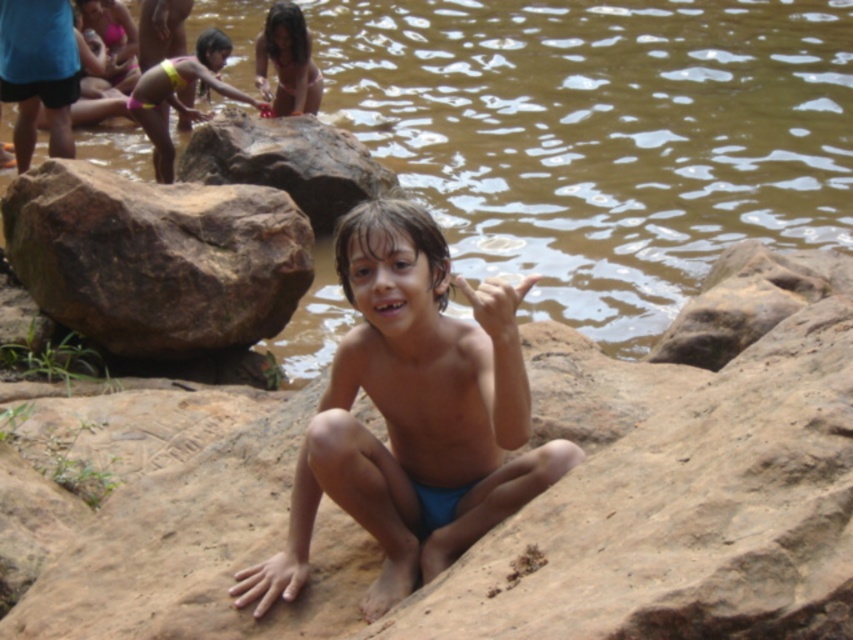
Question: Considering the relative positions of blue fabric boy at center and matte pink bikini at upper left in the image provided, where is blue fabric boy at center located with respect to matte pink bikini at upper left?

Choices:
 (A) left
 (B) right

Answer: (B)

Question: Does brown rough rock at left have a larger size compared to brown rough rock at center-left?

Choices:
 (A) no
 (B) yes

Answer: (A)

Question: Which object is the farthest from the matte pink swimsuit at upper left?

Choices:
 (A) brown rough rock at center-left
 (B) brown muddy water at center
 (C) blue fabric boy at center
 (D) matte pink bikini at upper left

Answer: (C)

Question: Which point is closer to the camera?

Choices:
 (A) (99, 177)
 (B) (103, 132)
 (C) (161, 173)
 (D) (283, 4)

Answer: (A)

Question: Which point is closer to the camera taking this photo?

Choices:
 (A) (260, 104)
 (B) (651, 301)
 (C) (286, 80)

Answer: (B)

Question: Can you confirm if blue fabric boy at center is smaller than matte pink bikini at upper left?

Choices:
 (A) no
 (B) yes

Answer: (A)